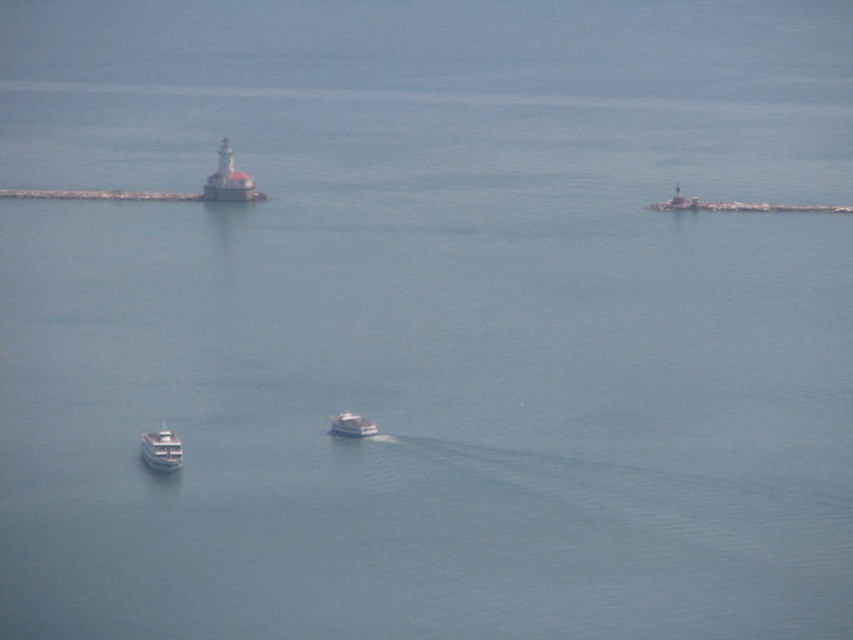
Can you confirm if white glossy lighthouse at upper center is taller than white glossy boat at lower left?

Correct, white glossy lighthouse at upper center is much taller as white glossy boat at lower left.

Does white glossy lighthouse at upper center appear under white glossy boat at lower left?

Incorrect, white glossy lighthouse at upper center is not positioned below white glossy boat at lower left.

Does point (238, 186) come in front of point (166, 428)?

No.

Locate an element on the screen. This screenshot has width=853, height=640. white glossy lighthouse at upper center is located at coordinates (229, 180).

Is white glossy boat at lower left shorter than white glossy boat at center?

In fact, white glossy boat at lower left may be taller than white glossy boat at center.

Who is taller, white glossy boat at lower left or white glossy boat at center?

With more height is white glossy boat at lower left.

Image resolution: width=853 pixels, height=640 pixels. In order to click on white glossy boat at lower left in this screenshot , I will do `click(160, 451)`.

The width and height of the screenshot is (853, 640). What are the coordinates of `white glossy boat at lower left` in the screenshot? It's located at (160, 451).

Is white glossy lighthouse at upper center closer to the viewer compared to white glossy boat at center?

No, white glossy lighthouse at upper center is further to the viewer.

Is white glossy lighthouse at upper center above white glossy boat at center?

Correct, white glossy lighthouse at upper center is located above white glossy boat at center.

What do you see at coordinates (229, 180) in the screenshot?
I see `white glossy lighthouse at upper center` at bounding box center [229, 180].

Where is `white glossy lighthouse at upper center`? white glossy lighthouse at upper center is located at coordinates (229, 180).